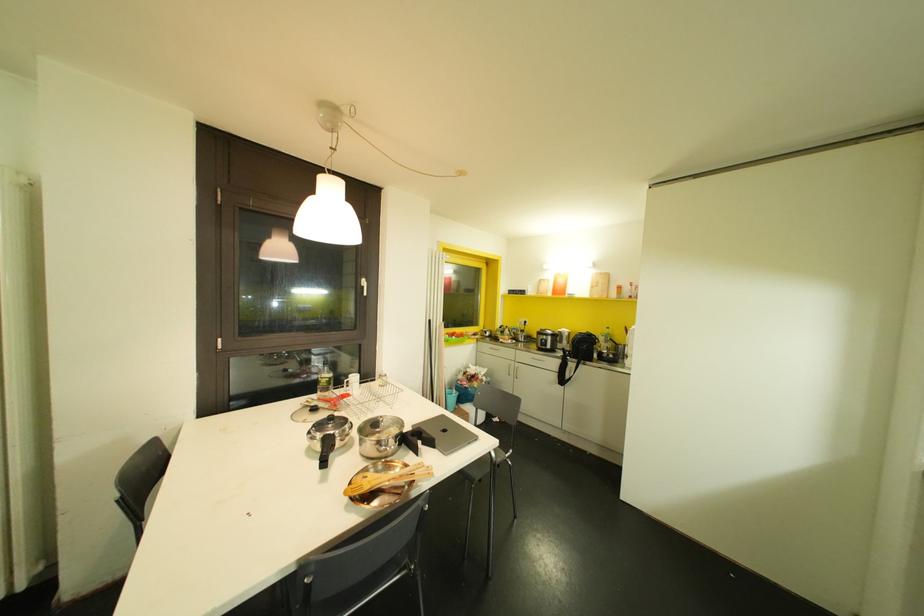
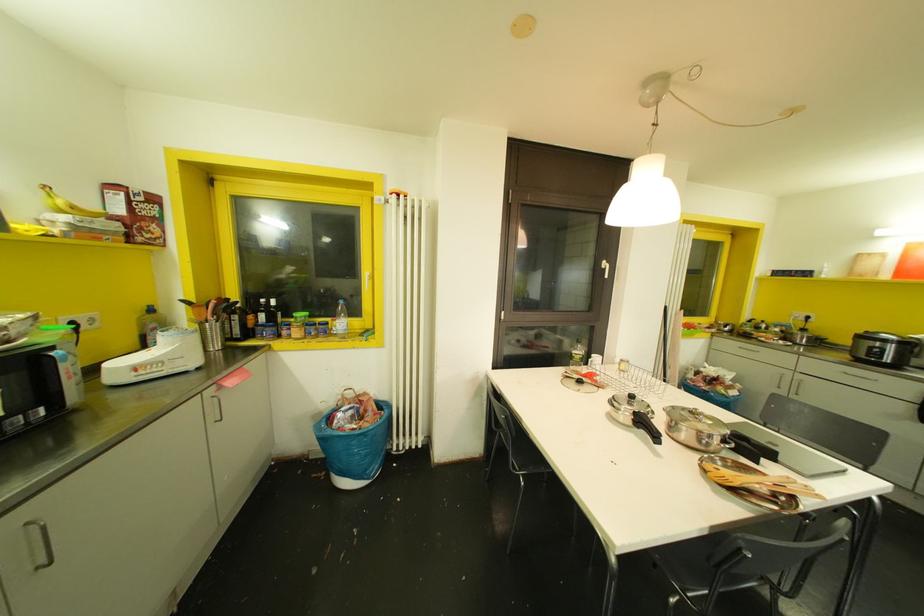
In the second image, find the point that corresponds to pixel 363 294 in the first image.

(605, 276)